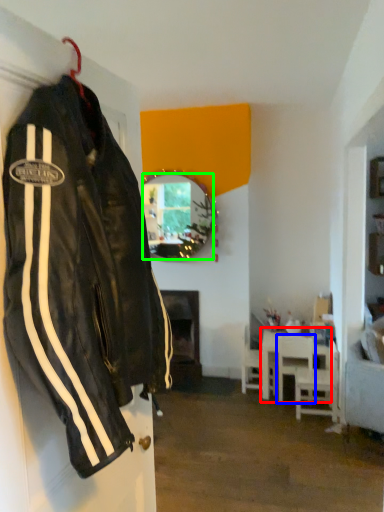
Question: Based on their relative distances, which object is farther from table (highlighted by a red box)? Choose from chair (highlighted by a blue box) and mirror (highlighted by a green box).

Choices:
 (A) chair
 (B) mirror

Answer: (B)